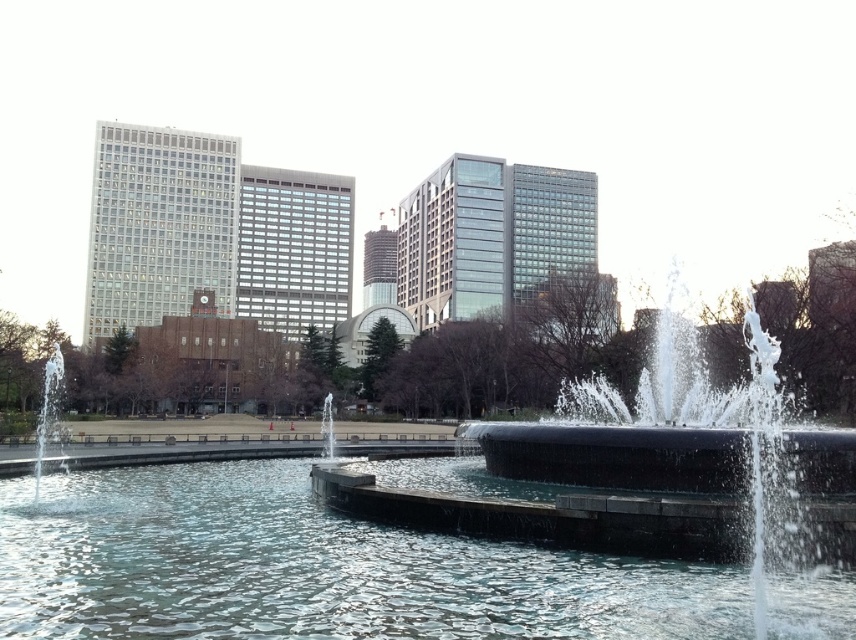
Can you confirm if clear water at center is taller than clear glass fountain at center?

No.

Between point (69, 616) and point (321, 452), which one is positioned in front?

Point (69, 616)

Image resolution: width=856 pixels, height=640 pixels. I want to click on clear water at center, so click(x=312, y=568).